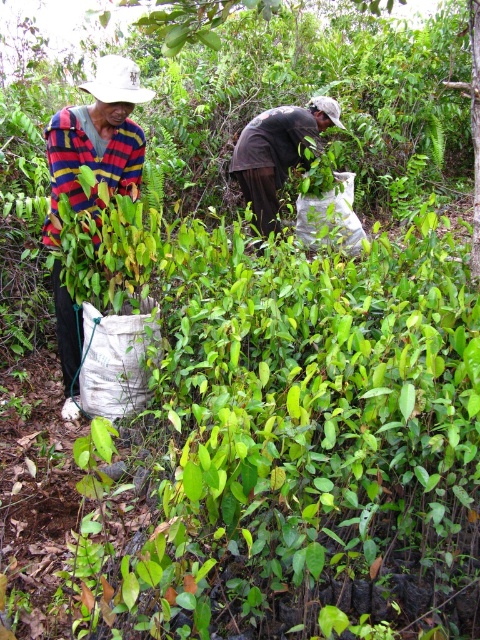
You are a hiker who needs to determine which item is larger in size between the striped fabric shirt at left and the brown fabric bag at center. Which one is bigger?

The striped fabric shirt at left is bigger than the brown fabric bag at center.

Based on the scene description, where is the striped fabric shirt at left located in the image?

The striped fabric shirt at left is located at point (96, 141) in the image.

You are a gardener who needs to reach the brown fabric bag at center while holding a plant. You are currently standing next to the striped fabric shirt at left. Can you stretch your arm to grab the bag without moving your feet? Assume your arm can reach 1.5 meters.

The distance between the striped fabric shirt at left and the brown fabric bag at center is 1.62 meters, which is longer than your arm reach of 1.5 meters. You cannot reach the bag without moving your feet.